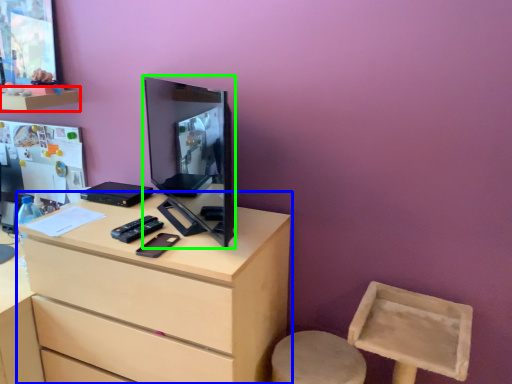
Question: Based on their relative distances, which object is farther from shelf (highlighted by a red box)? Choose from chest of drawers (highlighted by a blue box) and computer monitor (highlighted by a green box).

Choices:
 (A) chest of drawers
 (B) computer monitor

Answer: (A)